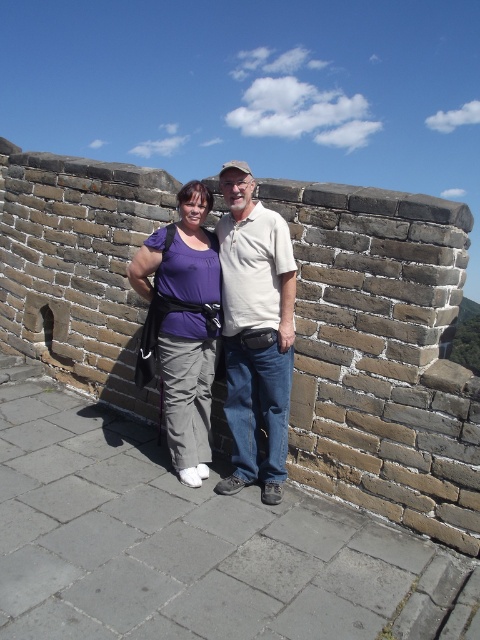
How much distance is there between purple cotton shirt at center and purple fabric pants at center?

purple cotton shirt at center is 15.42 inches away from purple fabric pants at center.

Can you confirm if purple cotton shirt at center is positioned to the right of purple fabric pants at center?

Indeed, purple cotton shirt at center is positioned on the right side of purple fabric pants at center.

Locate an element on the screen. This screenshot has width=480, height=640. purple cotton shirt at center is located at coordinates (255, 332).

Can you confirm if white cotton shirt at center is wider than purple fabric pants at center?

Incorrect, white cotton shirt at center's width does not surpass purple fabric pants at center's.

The height and width of the screenshot is (640, 480). Identify the location of white cotton shirt at center. (255, 332).

Is point (263, 472) closer to camera compared to point (222, 257)?

No, (263, 472) is further to viewer.

Does purple cotton shirt at center have a lesser width compared to white cotton shirt at center?

Indeed, purple cotton shirt at center has a lesser width compared to white cotton shirt at center.

Which is behind, point (269, 480) or point (286, 385)?

The point (269, 480) is more distant.

Where is `purple cotton shirt at center`? purple cotton shirt at center is located at coordinates (x=255, y=332).